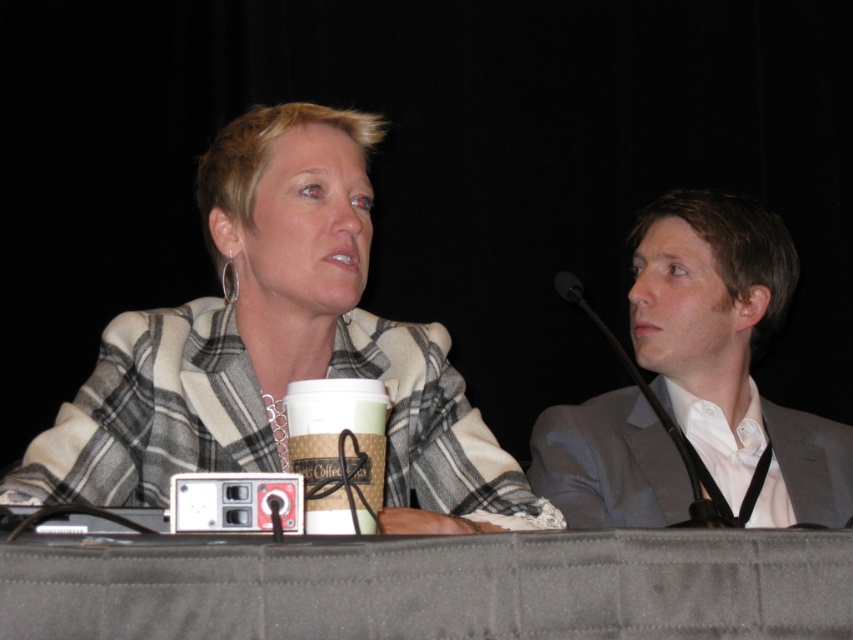
Is plaid fabric jacket at center above gray fabric suit at right?

Yes.

Is plaid fabric jacket at center bigger than gray fabric suit at right?

No, plaid fabric jacket at center is not bigger than gray fabric suit at right.

Which is in front, point (282, 141) or point (637, 500)?

Point (282, 141) is in front.

Locate an element on the screen. This screenshot has width=853, height=640. plaid fabric jacket at center is located at coordinates [x=277, y=348].

Can you confirm if gray fabric suit at right is bigger than black matte microphone at right?

Yes.

Who is more forward, [746,452] or [619,349]?

Point [619,349] is in front.

This screenshot has width=853, height=640. Find the location of `gray fabric suit at right`. gray fabric suit at right is located at coordinates (730, 353).

Can you confirm if brown paper cup at center is positioned above black matte microphone at right?

No, brown paper cup at center is not above black matte microphone at right.

Is point (358, 417) closer to camera compared to point (692, 513)?

Yes.

What do you see at coordinates (338, 451) in the screenshot?
I see `brown paper cup at center` at bounding box center [338, 451].

Where is `brown paper cup at center`? The image size is (853, 640). brown paper cup at center is located at coordinates (338, 451).